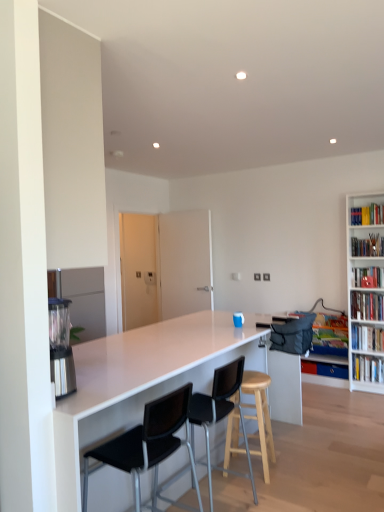
Question: Visually, is hardcover book at upper right, which is the 3th book from top to bottom, positioned to the left or to the right of white matte bookshelf at right, which appears as the 4th book when ordered from the bottom?

Choices:
 (A) right
 (B) left

Answer: (A)

Question: Is hardcover book at upper right, which is the 3th book from top to bottom, in front of or behind white matte bookshelf at right, acting as the 4th book starting from the top, in the image?

Choices:
 (A) behind
 (B) front

Answer: (A)

Question: Estimate the real-world distances between objects in this image. Which object is farther from the hardcover book at center, placed as the first book when sorted from bottom to top?

Choices:
 (A) light wood stool at center
 (B) white matte bookshelf at right, positioned as the 3th book in bottom-to-top order
 (C) stainless steel blender at left
 (D) hardcover book at upper right, which is the 1th book in top-to-bottom order
 (E) hardcover book at upper right, the fifth book when ordered from bottom to top

Answer: (C)

Question: Which object is the farthest from the white matte bookshelf at right, which appears as the 4th book when ordered from the bottom?

Choices:
 (A) hardcover book at right, acting as the 6th book starting from the top
 (B) light wood stool at center
 (C) white matte bookshelf at right, positioned as the 3th book in bottom-to-top order
 (D) hardcover book at upper right, which is the 1th book in top-to-bottom order
 (E) hardcover book at center, which appears as the 7th book when viewed from the top

Answer: (B)